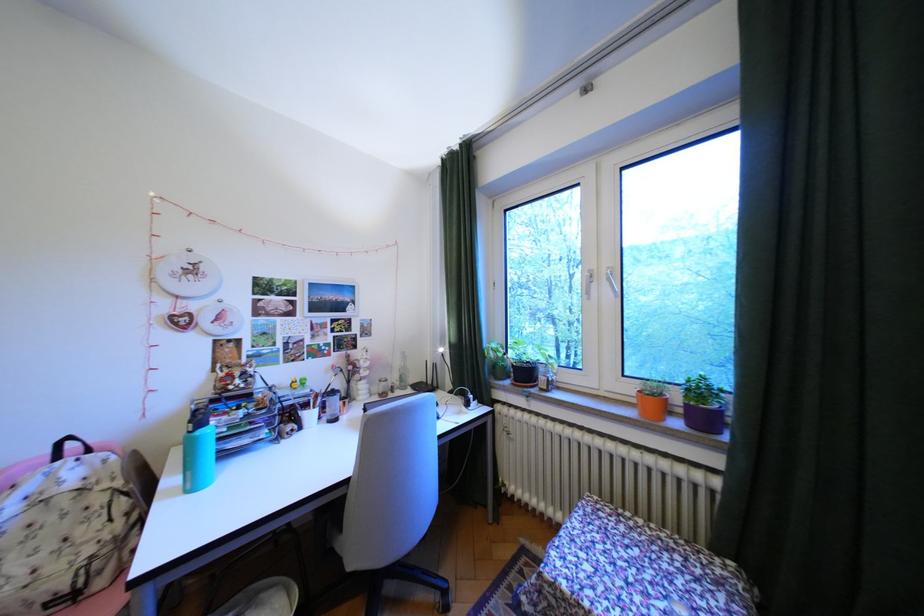
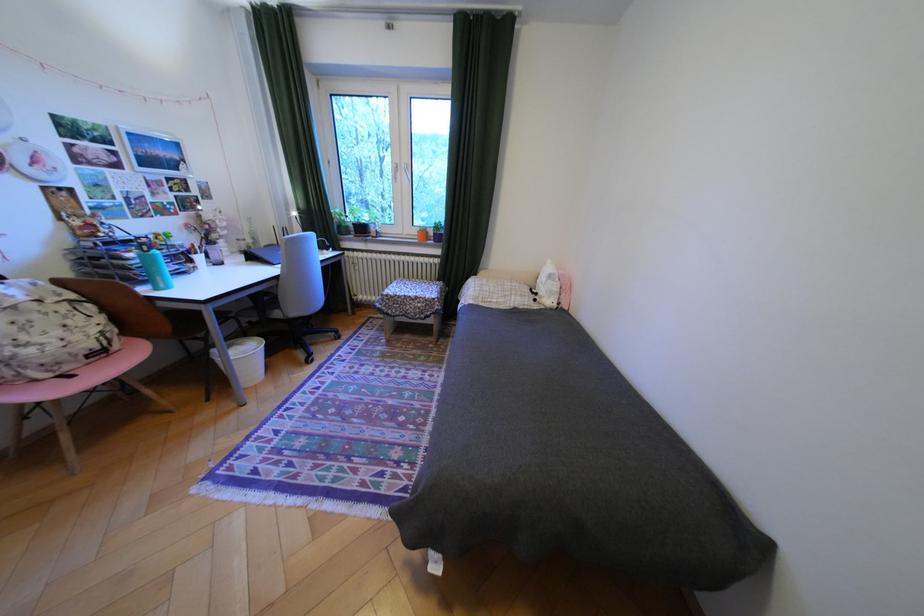
Where in the second image is the point corresponding to pixel 359 483 from the first image?

(288, 278)